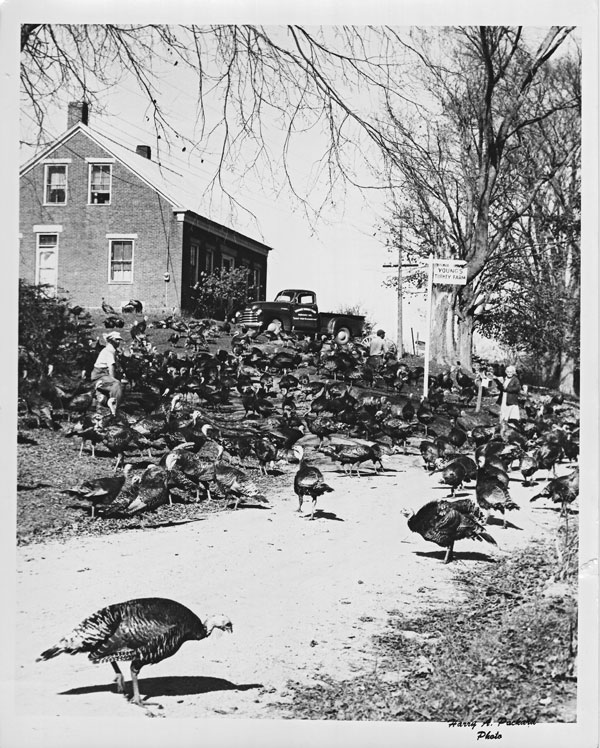
Image resolution: width=600 pixels, height=748 pixels. I want to click on front door, so click(48, 266).